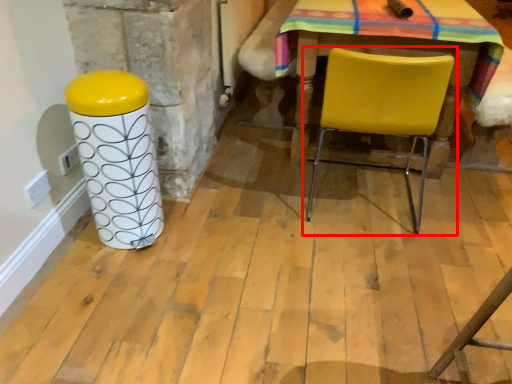
Question: From the image, what is the correct spatial relationship of chair (annotated by the red box) in relation to pillar?

Choices:
 (A) right
 (B) left

Answer: (A)